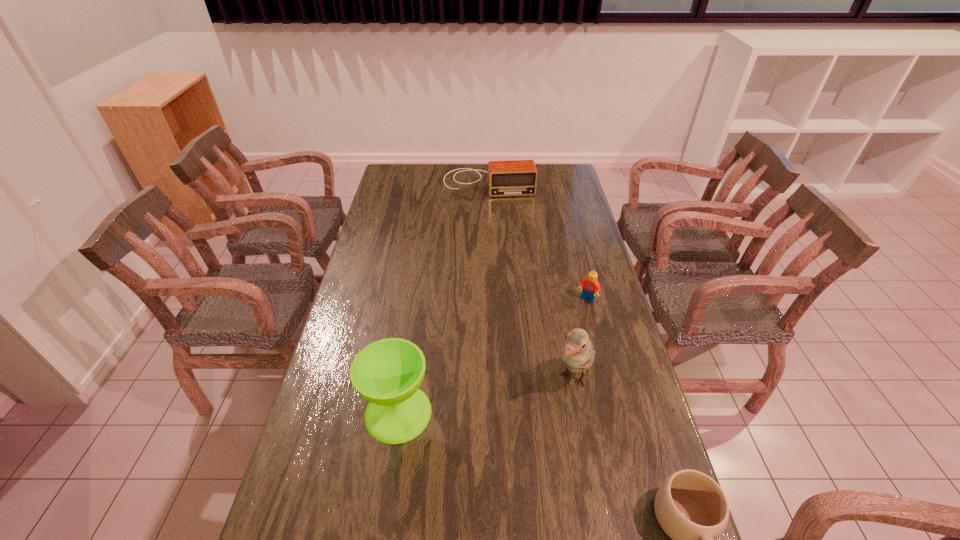
Locate an element on the screen. vacant region at the left edge is located at coordinates (356, 353).

In the image, there is a desktop. Where is `free region at the right edge`? Image resolution: width=960 pixels, height=540 pixels. free region at the right edge is located at coordinates (641, 497).

In the image, there is a desktop. Where is `vacant space at the far left corner`? Image resolution: width=960 pixels, height=540 pixels. vacant space at the far left corner is located at coordinates (401, 175).

Identify the location of blank space at the near left corner. The image size is (960, 540). pos(346,515).

Identify the location of free space between the Lego and the wineglass. The width and height of the screenshot is (960, 540). (492, 356).

Locate an element on the screen. This screenshot has height=540, width=960. empty space between the farthest object and the bird is located at coordinates (531, 281).

You are a GUI agent. You are given a task and a screenshot of the screen. Output one action in this format:
    pyautogui.click(x=<x>, y=<y>)
    Task: Click on the unoccupied position between the second tallest object and the radio receiver
    
    Given the screenshot: What is the action you would take?
    pyautogui.click(x=444, y=298)

I want to click on free spot between the wineglass and the tallest object, so click(x=486, y=396).

This screenshot has height=540, width=960. I want to click on empty space that is in between the radio receiver and the second tallest object, so click(x=444, y=298).

Locate an element on the screen. Image resolution: width=960 pixels, height=540 pixels. vacant area that lies between the radio receiver and the wineglass is located at coordinates (444, 298).